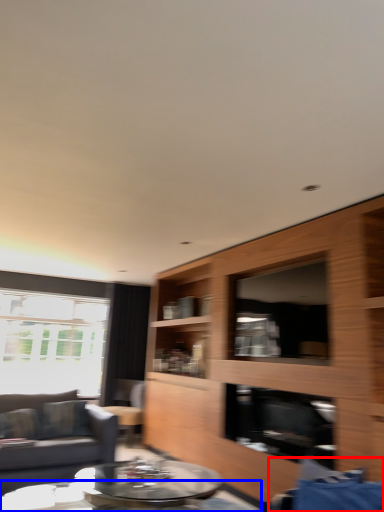
Question: Which object appears farthest to the camera in this image, swivel chair (highlighted by a red box) or coffee table (highlighted by a blue box)?

Choices:
 (A) swivel chair
 (B) coffee table

Answer: (B)